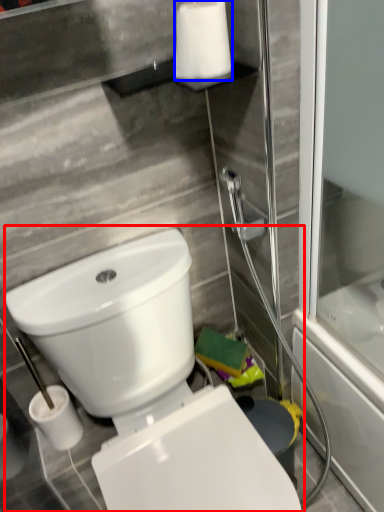
Question: Which point is closer to the camera, toilet (highlighted by a red box) or toilet paper (highlighted by a blue box)?

Choices:
 (A) toilet
 (B) toilet paper

Answer: (A)